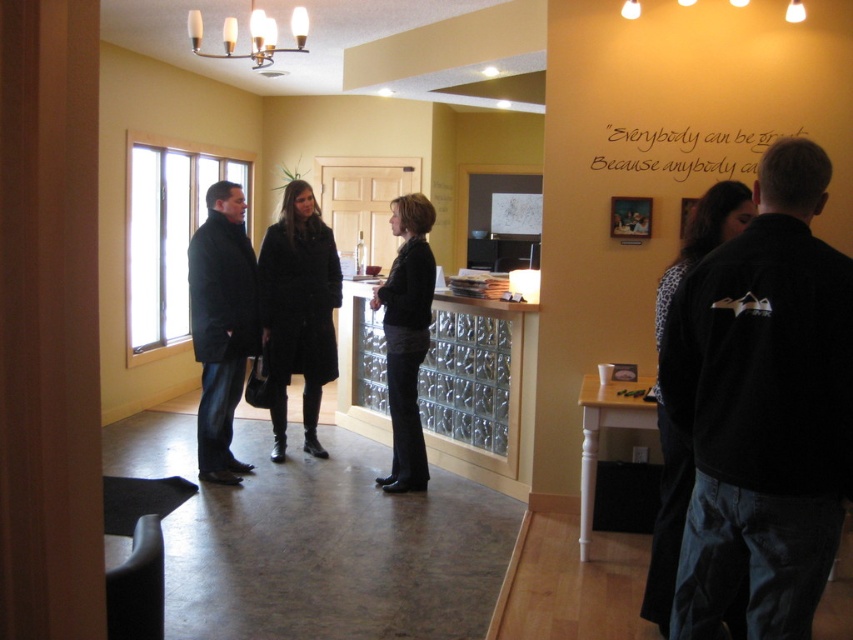
You are an office worker who just arrived at the reception desk. You see the black fleece jacket at right hanging on a hook behind the glass block partition. Can you reach it without moving past the partition?

The black fleece jacket at right is located at point (763, 408), which is behind the glass block partition. Since you cannot move past the partition, you cannot reach it.

You are organizing a charity clothing drive and need to decide which of the two coats, the black fleece jacket at right or the dark gray coat at left, can fit into a storage box that has a width capacity of 30 cm. Based on their sizes, which coat is more likely to fit?

The black fleece jacket at right has a lesser width compared to the dark gray coat at left, so it is more likely to fit into the 30 cm width storage box.